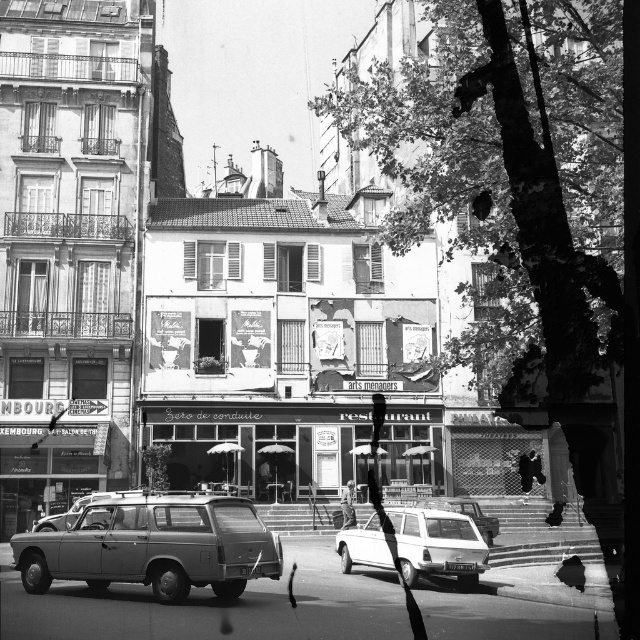
Who is positioned more to the right, metallic gray station wagon at lower left or white matte station wagon at center?

white matte station wagon at center is more to the right.

Image resolution: width=640 pixels, height=640 pixels. Describe the element at coordinates (154, 547) in the screenshot. I see `metallic gray station wagon at lower left` at that location.

Describe the element at coordinates (154, 547) in the screenshot. Image resolution: width=640 pixels, height=640 pixels. I see `metallic gray station wagon at lower left` at that location.

Where is `metallic gray station wagon at lower left`? This screenshot has width=640, height=640. metallic gray station wagon at lower left is located at coordinates (154, 547).